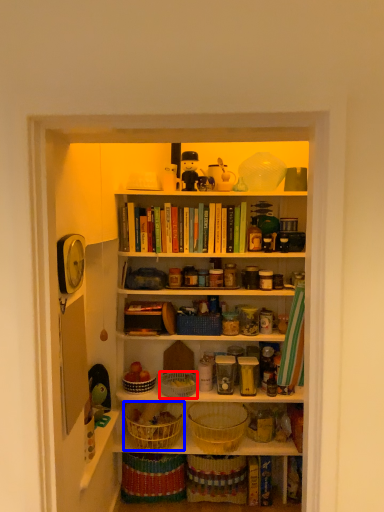
Question: Among these objects, which one is nearest to the camera, basket (highlighted by a red box) or basket (highlighted by a blue box)?

Choices:
 (A) basket
 (B) basket

Answer: (B)